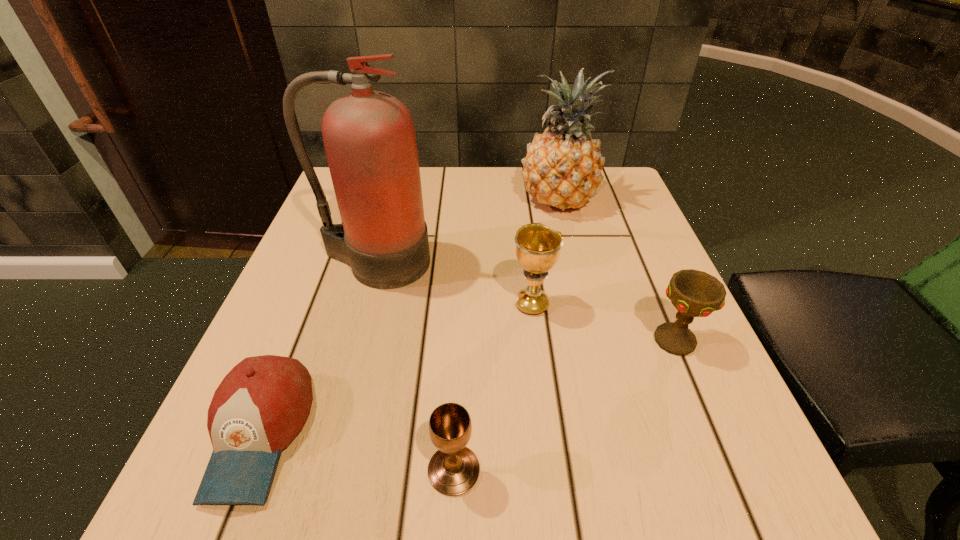
You are a GUI agent. You are given a task and a screenshot of the screen. Output one action in this format:
    pyautogui.click(x=<x>, y=<y>)
    Task: Click on the pineapple that is at the right edge
    
    Given the screenshot: What is the action you would take?
    pyautogui.click(x=562, y=168)

Identify the location of chalice located at the right edge. (693, 293).

What are the coordinates of `object at the near left corner` in the screenshot? It's located at (261, 405).

Find the location of a particular element. object present at the far right corner is located at coordinates tap(562, 168).

Image resolution: width=960 pixels, height=540 pixels. In the image, there is a desktop. In order to click on free space at the far edge in this screenshot , I will do `click(452, 171)`.

Where is `vacant space at the near edge of the desktop`? This screenshot has height=540, width=960. vacant space at the near edge of the desktop is located at coordinates (378, 514).

The width and height of the screenshot is (960, 540). Identify the location of vacant space at the left edge. (311, 328).

You are a GUI agent. You are given a task and a screenshot of the screen. Output one action in this format:
    pyautogui.click(x=<x>, y=<y>)
    Task: Click on the vacant space at the right edge of the desktop
    
    Given the screenshot: What is the action you would take?
    pyautogui.click(x=625, y=393)

Locate an element on the screen. The height and width of the screenshot is (540, 960). free space at the far right corner is located at coordinates (624, 201).

This screenshot has height=540, width=960. What are the coordinates of `vacant space that's between the farthest object and the fourth farthest object` in the screenshot? It's located at (616, 271).